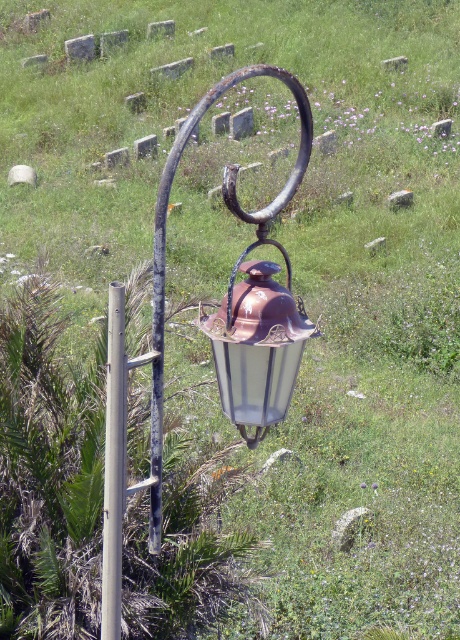
Is point (259, 214) positioned in front of point (118, 436)?

Yes, it is.

The image size is (460, 640). In order to click on rusty metal lantern at center in this screenshot , I will do `click(234, 212)`.

In order to click on copper/textured lantern at center in this screenshot , I will do `click(257, 342)`.

Can you confirm if copper/textured lantern at center is bigger than rusty metal lantern at center?

Actually, copper/textured lantern at center might be smaller than rusty metal lantern at center.

Locate an element on the screen. The image size is (460, 640). copper/textured lantern at center is located at coordinates coord(257,342).

Is copper/textured lantern at center above silver metallic pole at center-left?

Yes, copper/textured lantern at center is above silver metallic pole at center-left.

Does copper/textured lantern at center appear on the left side of silver metallic pole at center-left?

In fact, copper/textured lantern at center is to the right of silver metallic pole at center-left.

Is point (247, 292) more distant than point (110, 404)?

No.

You are a GUI agent. You are given a task and a screenshot of the screen. Output one action in this format:
    pyautogui.click(x=<x>, y=<y>)
    Task: Click on the copper/textured lantern at center
    The width and height of the screenshot is (460, 640).
    Given the screenshot: What is the action you would take?
    pyautogui.click(x=257, y=342)